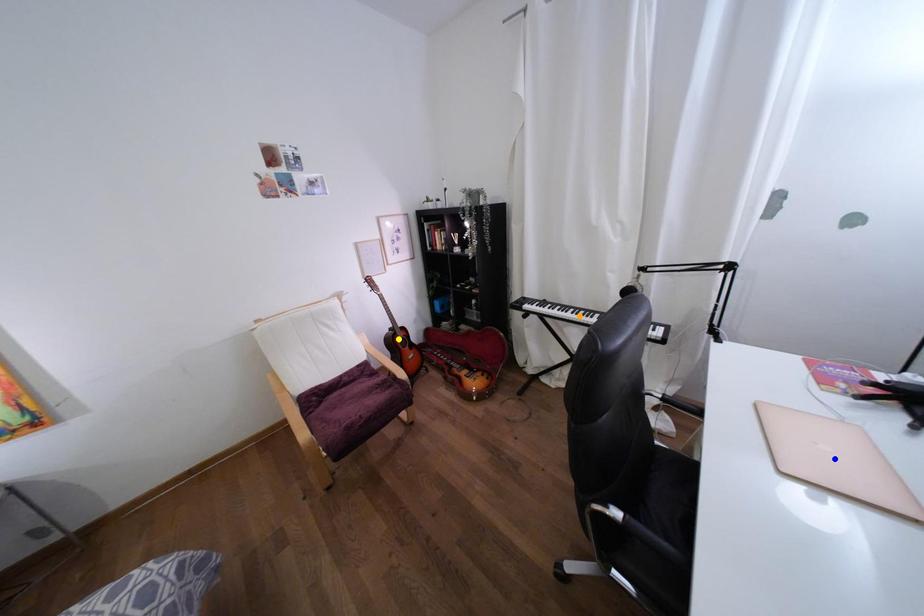
Order these from nearest to farthest:
- orange point
- blue point
- yellow point

1. blue point
2. orange point
3. yellow point